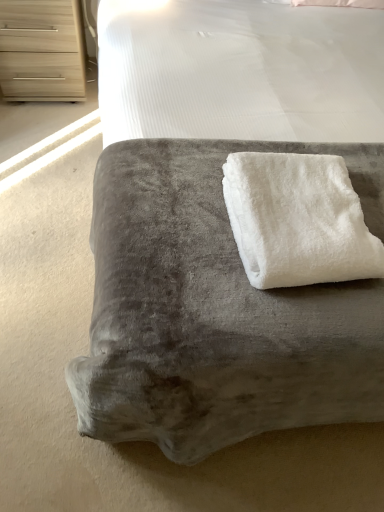
Question: In the image, is white fluffy towel at center on the left side or the right side of light wood chest of drawers at upper left?

Choices:
 (A) left
 (B) right

Answer: (B)

Question: Considering the positions of white fluffy towel at center and light wood chest of drawers at upper left in the image, is white fluffy towel at center taller or shorter than light wood chest of drawers at upper left?

Choices:
 (A) tall
 (B) short

Answer: (B)

Question: Which is nearer to the white fluffy towel at center?

Choices:
 (A) velvet gray ottoman at center
 (B) light wood chest of drawers at upper left

Answer: (A)

Question: Which object is positioned farthest from the white fluffy towel at center?

Choices:
 (A) velvet gray ottoman at center
 (B) light wood chest of drawers at upper left

Answer: (B)